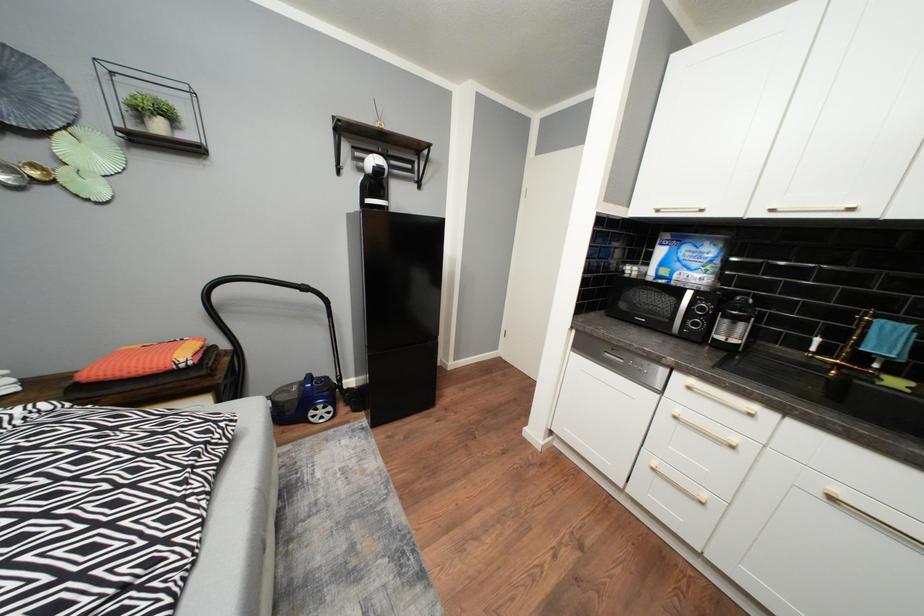
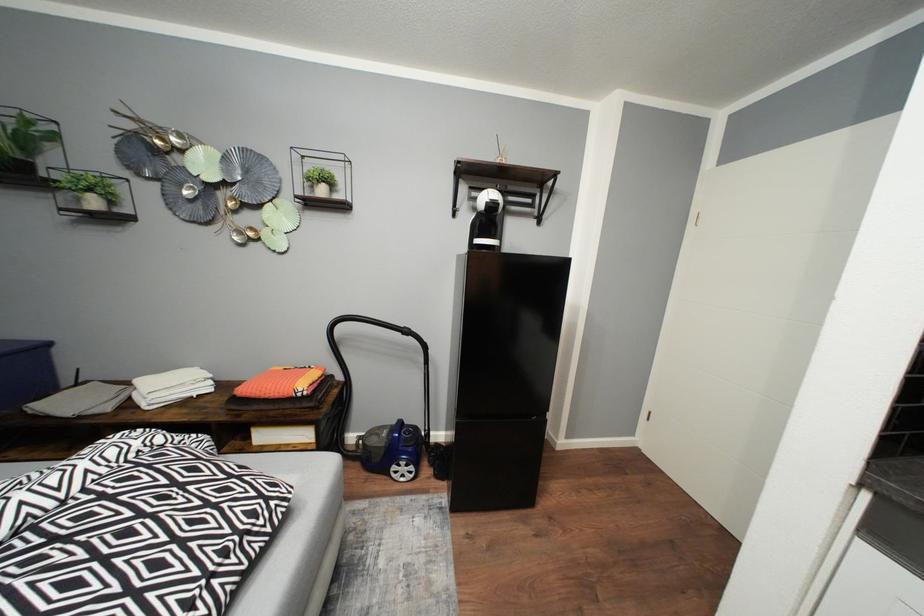
Question: The first image is from the beginning of the video and the second image is from the end. How did the camera likely rotate when shooting the video?

Choices:
 (A) Left
 (B) Right
 (C) Up
 (D) Down

Answer: (A)